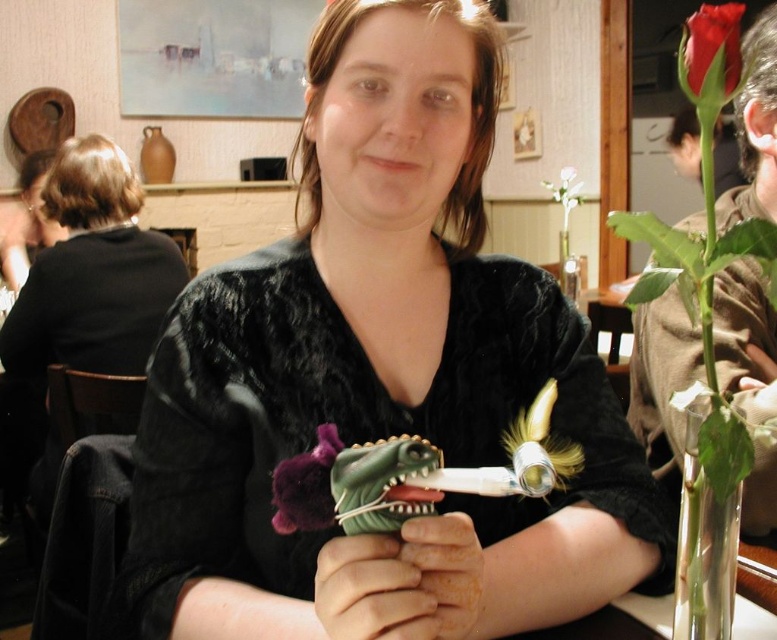
Question: Based on their relative distances, which object is nearer to the matte red rose at upper right?

Choices:
 (A) green matte toy at center
 (B) velvet purple flower at center
 (C) velvet black shirt at center

Answer: (C)

Question: Which of the following is the farthest from the observer?

Choices:
 (A) (734, 19)
 (B) (370, 573)
 (C) (241, 371)

Answer: (C)

Question: Is velvet black shirt at center thinner than matte red rose at upper right?

Choices:
 (A) yes
 (B) no

Answer: (B)

Question: Can you confirm if velvet black shirt at center is positioned below matte red rose at upper right?

Choices:
 (A) no
 (B) yes

Answer: (B)

Question: Which point appears farthest from the camera in this image?

Choices:
 (A) (471, 20)
 (B) (734, 56)

Answer: (A)

Question: Can you confirm if green matte toy at center is bigger than matte red rose at upper right?

Choices:
 (A) yes
 (B) no

Answer: (B)